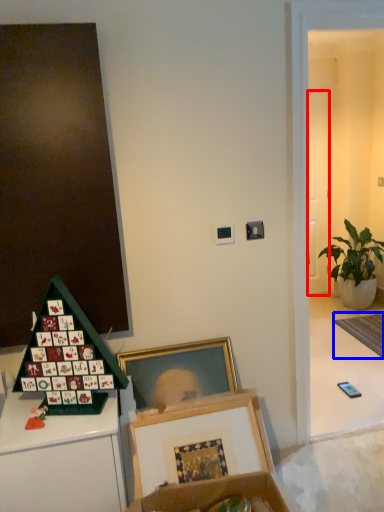
Question: Which point is further to the camera, door (highlighted by a red box) or mat (highlighted by a blue box)?

Choices:
 (A) door
 (B) mat

Answer: (A)